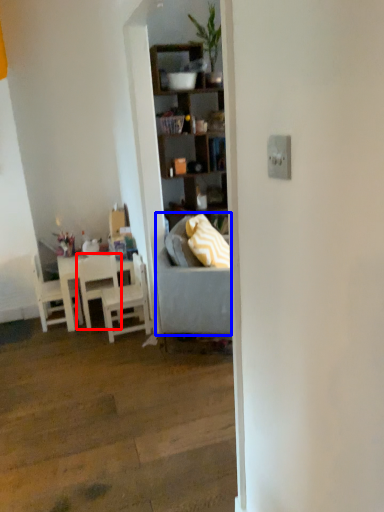
Question: Among these objects, which one is nearest to the camera, chair (highlighted by a red box) or studio couch (highlighted by a blue box)?

Choices:
 (A) chair
 (B) studio couch

Answer: (B)